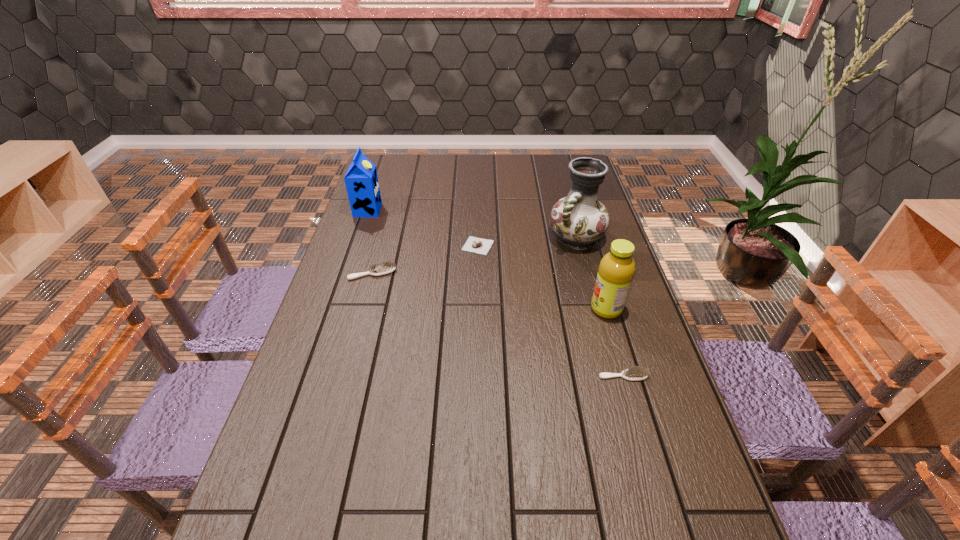
Find the location of `free point between the left scrubbing brush and the garlic`. free point between the left scrubbing brush and the garlic is located at coordinates (425, 260).

Locate an element on the screen. This screenshot has height=540, width=960. free space between the farthest object and the fruit juice is located at coordinates (487, 260).

At what (x,y) coordinates should I click in order to perform the action: click on free area in between the fruit juice and the nearest object. Please return your answer as a coordinate pair (x, y). This screenshot has width=960, height=540. Looking at the image, I should click on (614, 342).

Find the location of a particular element. free point between the farthest object and the fruit juice is located at coordinates (487, 260).

Locate an element on the screen. free space between the tallest object and the fifth farthest object is located at coordinates (591, 274).

Point out which object is positioned as the third nearest to the garlic. Please provide its 2D coordinates. Your answer should be formatted as a tuple, i.e. [(x, y)], where the tuple contains the x and y coordinates of a point satisfying the conditions above.

[(361, 180)]

Find the location of a particular element. The width and height of the screenshot is (960, 540). object that is the second nearest to the carton is located at coordinates (473, 244).

Where is `vacant area that satisfies the following two spatial constraints: 1. with the cap open on the garlic; 2. on the left side of the carton`? The height and width of the screenshot is (540, 960). vacant area that satisfies the following two spatial constraints: 1. with the cap open on the garlic; 2. on the left side of the carton is located at coordinates (355, 246).

Where is `vacant region that satisfies the following two spatial constraints: 1. on the front side of the tallest object; 2. on the left side of the right scrubbing brush`? Image resolution: width=960 pixels, height=540 pixels. vacant region that satisfies the following two spatial constraints: 1. on the front side of the tallest object; 2. on the left side of the right scrubbing brush is located at coordinates (612, 376).

You are a GUI agent. You are given a task and a screenshot of the screen. Output one action in this format:
    pyautogui.click(x=<x>, y=<y>)
    Task: Click on the free space that satisfies the following two spatial constraints: 1. on the back side of the left scrubbing brush; 2. on the right side of the garlic
    
    Given the screenshot: What is the action you would take?
    pyautogui.click(x=380, y=246)